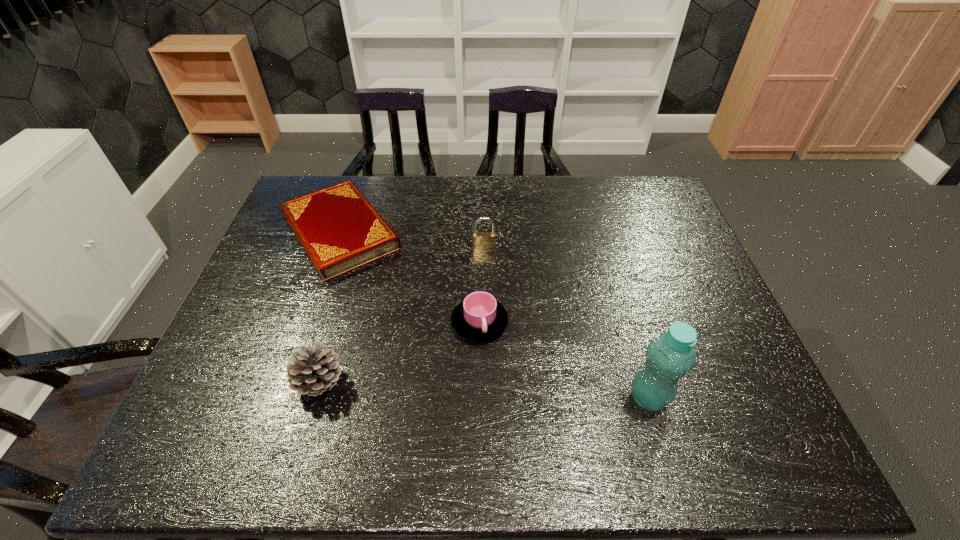
The image size is (960, 540). I want to click on vacant space on the desktop that is between the pinecone and the tallest object and is positioned on the cover of the shortest object, so click(x=453, y=389).

The image size is (960, 540). I want to click on free space on the desktop that is between the pinecone and the rightmost object and is positioned on the front-facing side of the padlock, so (x=483, y=390).

Image resolution: width=960 pixels, height=540 pixels. Identify the location of vacant space on the desktop that is between the pinecone and the tallest object and is positioned on the side with the handle of the third nearest object. (526, 392).